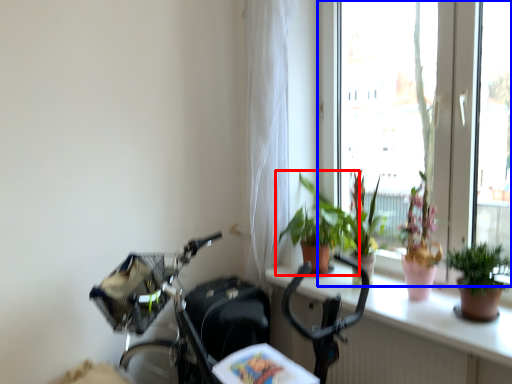
Question: Which of the following is the closest to the observer, houseplant (highlighted by a red box) or window (highlighted by a blue box)?

Choices:
 (A) houseplant
 (B) window

Answer: (B)